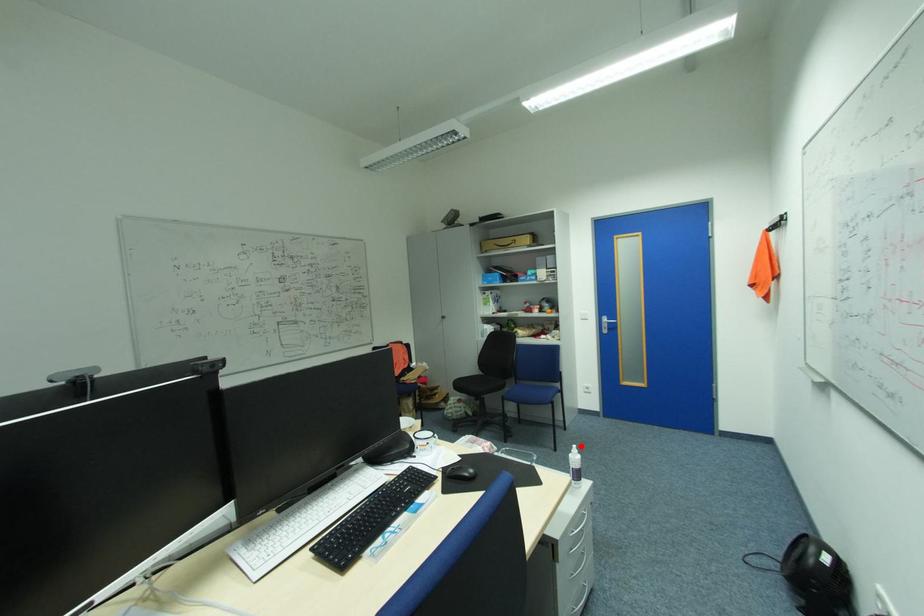
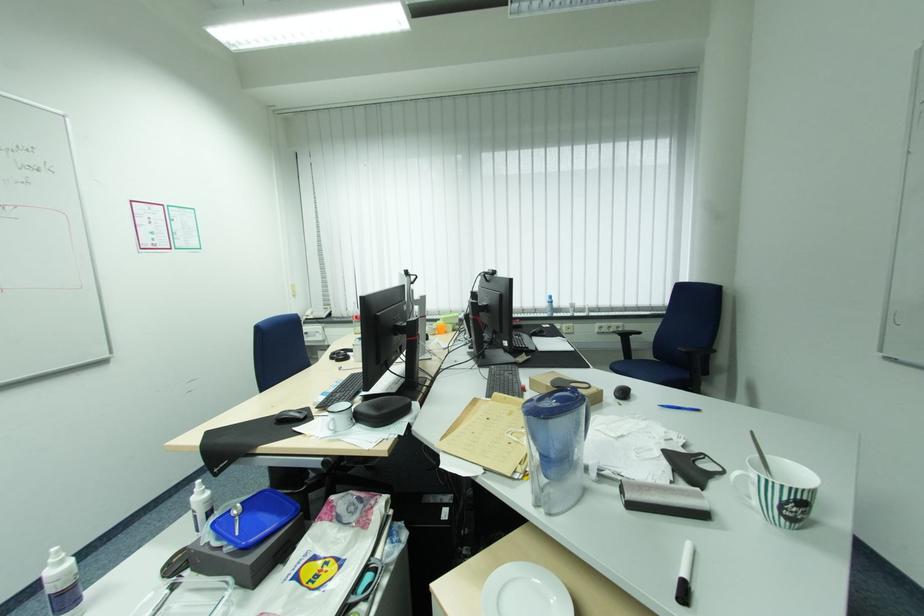
Question: I am providing you with two images of the same scene from different viewpoints. Image1 has a red point marked. In image2, the corresponding 3D location appears at what relative position? Reply with the corresponding letter.

Choices:
 (A) Closer
 (B) Farther

Answer: (B)